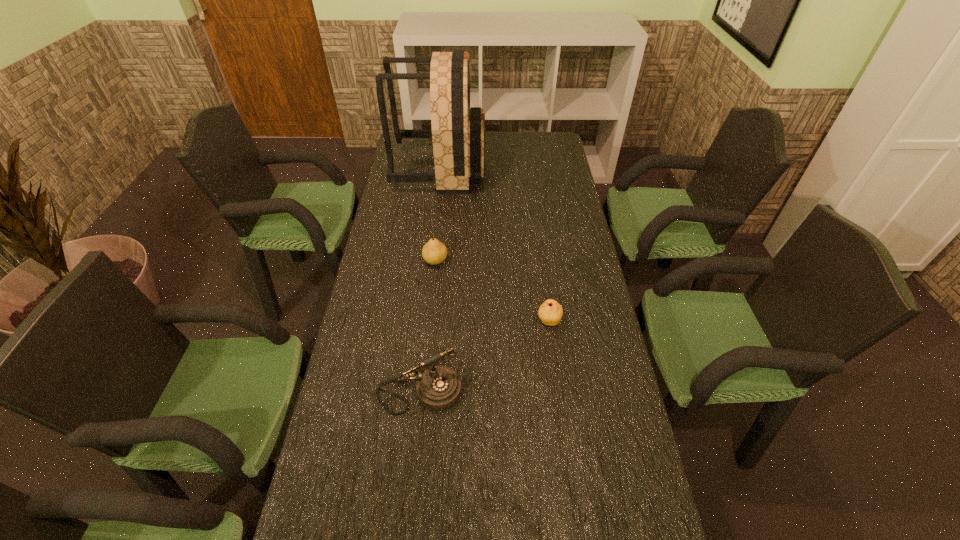
The image size is (960, 540). Find the location of `the farthest object`. the farthest object is located at coordinates (458, 133).

What are the coordinates of `the tallest object` in the screenshot? It's located at (458, 133).

Image resolution: width=960 pixels, height=540 pixels. Find the location of `the nearest object`. the nearest object is located at coordinates (438, 388).

Image resolution: width=960 pixels, height=540 pixels. Find the location of `the left pear`. the left pear is located at coordinates (434, 252).

In order to click on the second farthest object in this screenshot , I will do (434, 252).

Locate an element on the screen. the shortest object is located at coordinates (550, 312).

This screenshot has height=540, width=960. In order to click on the nearer pear in this screenshot , I will do `click(550, 312)`.

Find the location of a particular element. blank space located 0.200m on the front face of the farthest object is located at coordinates (532, 168).

Identify the location of free space located 0.250m on the front of the nearest object. Image resolution: width=960 pixels, height=540 pixels. (404, 528).

Find the location of a particular element. free location located on the right of the taller pear is located at coordinates (513, 261).